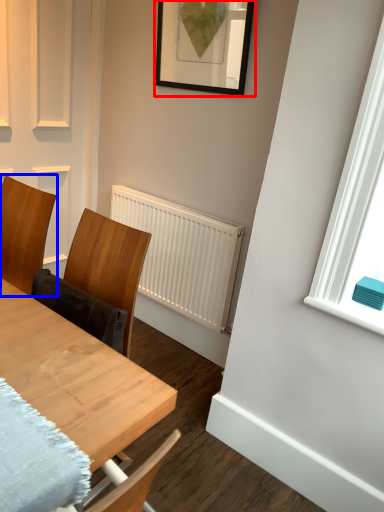
Question: Which point is closer to the camera, picture frame (highlighted by a red box) or chair (highlighted by a blue box)?

Choices:
 (A) picture frame
 (B) chair

Answer: (B)